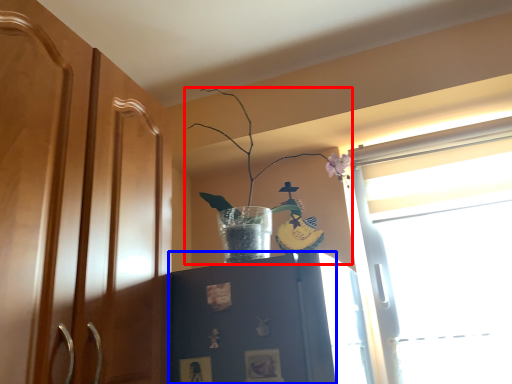
Question: Which of the following is the farthest to the observer, houseplant (highlighted by a red box) or cabinetry (highlighted by a blue box)?

Choices:
 (A) houseplant
 (B) cabinetry

Answer: (A)